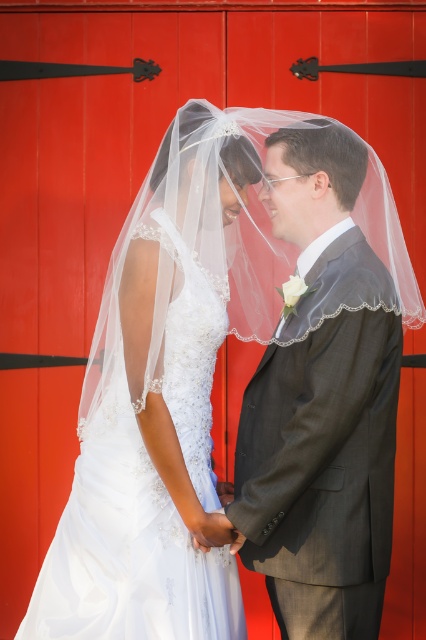
Question: Is gray textured suit at center behind white lace wedding dress at center?

Choices:
 (A) no
 (B) yes

Answer: (A)

Question: Considering the relative positions of gray textured suit at center and white lace wedding dress at center in the image provided, where is gray textured suit at center located with respect to white lace wedding dress at center?

Choices:
 (A) left
 (B) right

Answer: (B)

Question: Observing the image, what is the correct spatial positioning of gray textured suit at center in reference to white lace wedding dress at center?

Choices:
 (A) right
 (B) left

Answer: (A)

Question: Which point appears farthest from the camera in this image?

Choices:
 (A) (120, 484)
 (B) (256, 529)

Answer: (A)